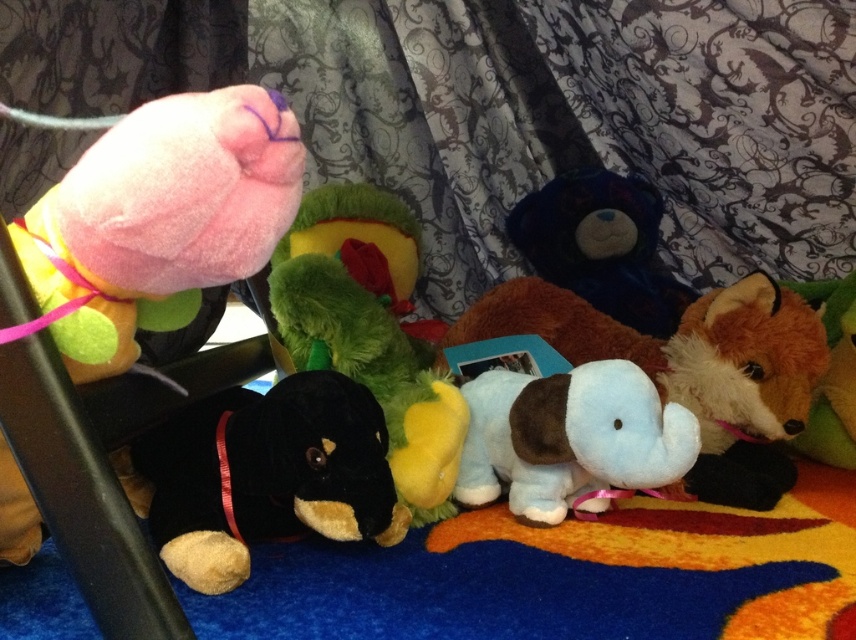
Does light blue plush dog at center appear under blue plush elephant at center?

No.

Is point (735, 384) farther from camera compared to point (560, 515)?

That is True.

Locate an element on the screen. The width and height of the screenshot is (856, 640). light blue plush dog at center is located at coordinates (693, 369).

Who is positioned more to the right, black plush dog at lower left or blue plush elephant at center?

From the viewer's perspective, blue plush elephant at center appears more on the right side.

Find the location of `black plush dog at lower left`. black plush dog at lower left is located at coordinates (266, 474).

The width and height of the screenshot is (856, 640). In order to click on black plush dog at lower left in this screenshot , I will do `click(266, 474)`.

In order to click on black plush dog at lower left in this screenshot , I will do `click(266, 474)`.

Does point (186, 545) lie in front of point (690, 378)?

Yes, point (186, 545) is closer to viewer.

Find the location of a particular element. black plush dog at lower left is located at coordinates (266, 474).